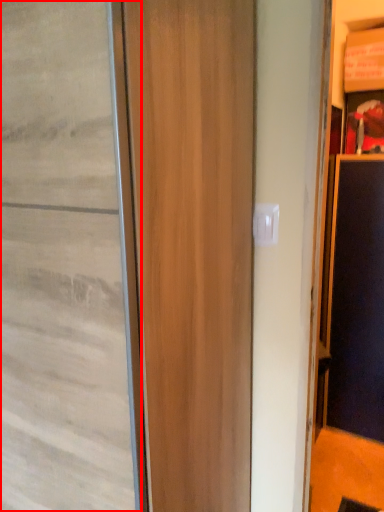
Question: Where is door (annotated by the red box) located in relation to screen door in the image?

Choices:
 (A) right
 (B) left

Answer: (B)